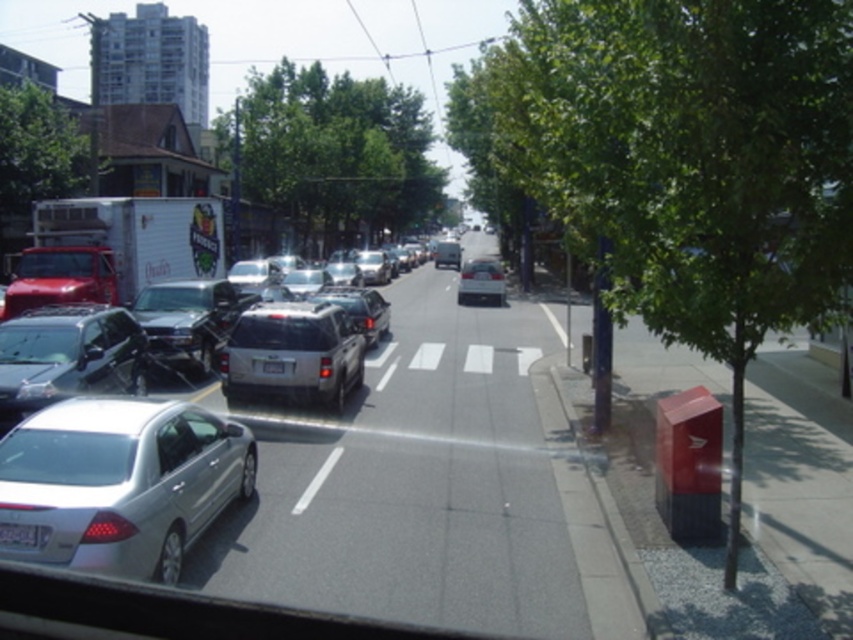
You are a pedestrian standing at the crosswalk in the middle of the street. You notice a green leafy tree at center and a satin silver sedan at center. Which object is taller?

The green leafy tree at center is taller than the satin silver sedan at center.

You are a delivery driver navigating through the urban street scene. You need to deliver a package to a location marked by the point at coordinates (679, 163). Based on the scene description, can you determine which object this point is located on?

The point at coordinates (679, 163) is located on the green leafy tree at right.

You are a delivery driver who needs to park your car in this area. You notice the green leafy tree at right and the white plastic license plate at lower left. Which object takes up more horizontal space in the image?

The green leafy tree at right takes up more horizontal space in the image because its width surpasses that of the white plastic license plate at lower left.